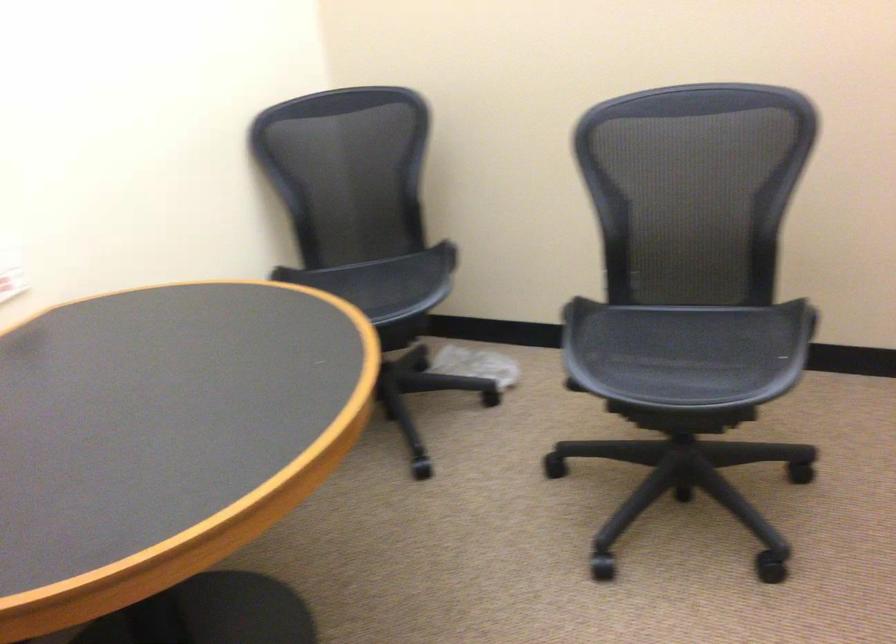
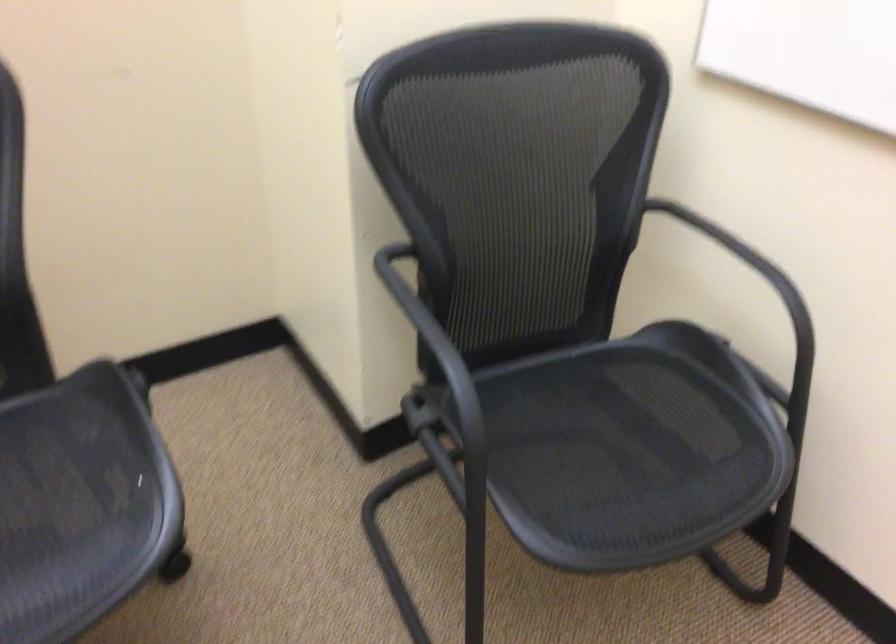
Question: The images are taken continuously from a first-person perspective. In which direction is your viewpoint rotating?

Choices:
 (A) Left
 (B) Right
 (C) Up
 (D) Down

Answer: (B)